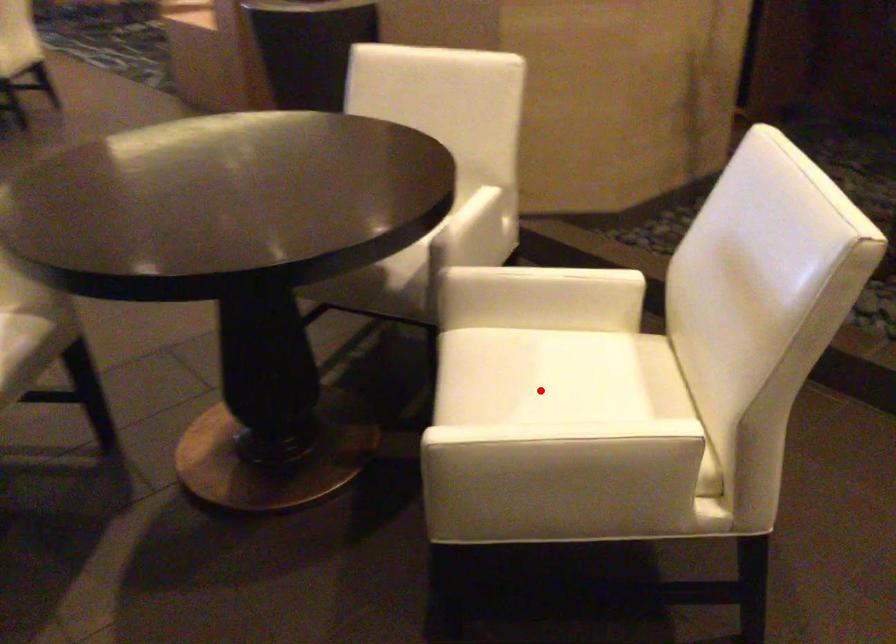
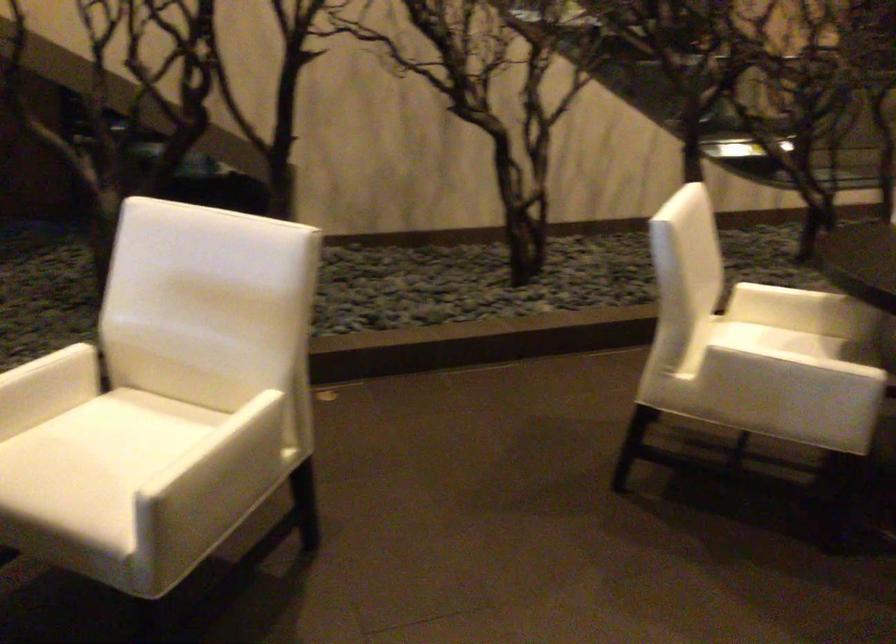
The point at the highlighted location is marked in the first image. Where is the corresponding point in the second image?

(105, 458)